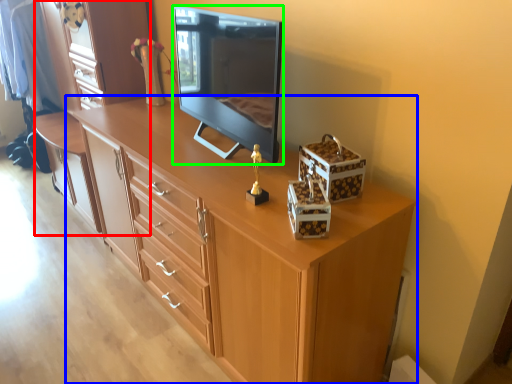
Question: Considering the real-world distances, which object is farthest from dresser (highlighted by a red box)? chest of drawers (highlighted by a blue box) or television (highlighted by a green box)?

Choices:
 (A) chest of drawers
 (B) television

Answer: (A)